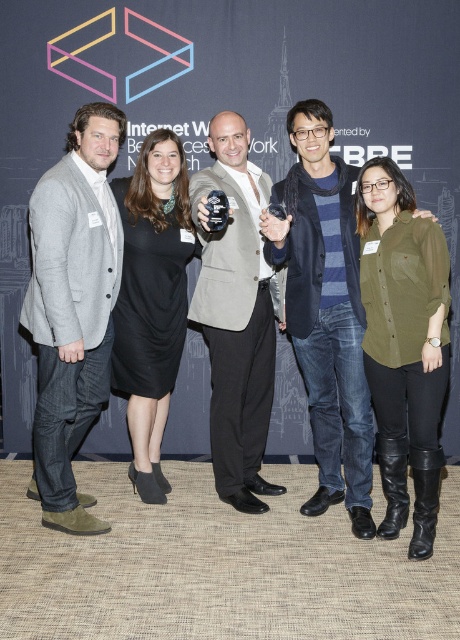
Question: Is dark blue striped sweater at center to the left of olive-green cotton shirt at center-right from the viewer's perspective?

Choices:
 (A) yes
 (B) no

Answer: (A)

Question: Which object is farther from the camera taking this photo?

Choices:
 (A) matte gray blazer at left
 (B) matte gray blazer at center
 (C) black dress at center

Answer: (C)

Question: Which object is the closest to the matte gray blazer at left?

Choices:
 (A) black dress at center
 (B) olive-green cotton shirt at center-right
 (C) matte gray blazer at center
 (D) dark blue striped sweater at center

Answer: (A)

Question: Can you confirm if olive-green cotton shirt at center-right is thinner than black dress at center?

Choices:
 (A) no
 (B) yes

Answer: (B)

Question: Is olive-green cotton shirt at center-right to the right of black dress at center from the viewer's perspective?

Choices:
 (A) no
 (B) yes

Answer: (B)

Question: Which object appears farthest from the camera in this image?

Choices:
 (A) matte gray blazer at left
 (B) dark blue striped sweater at center
 (C) olive-green cotton shirt at center-right
 (D) black dress at center

Answer: (D)